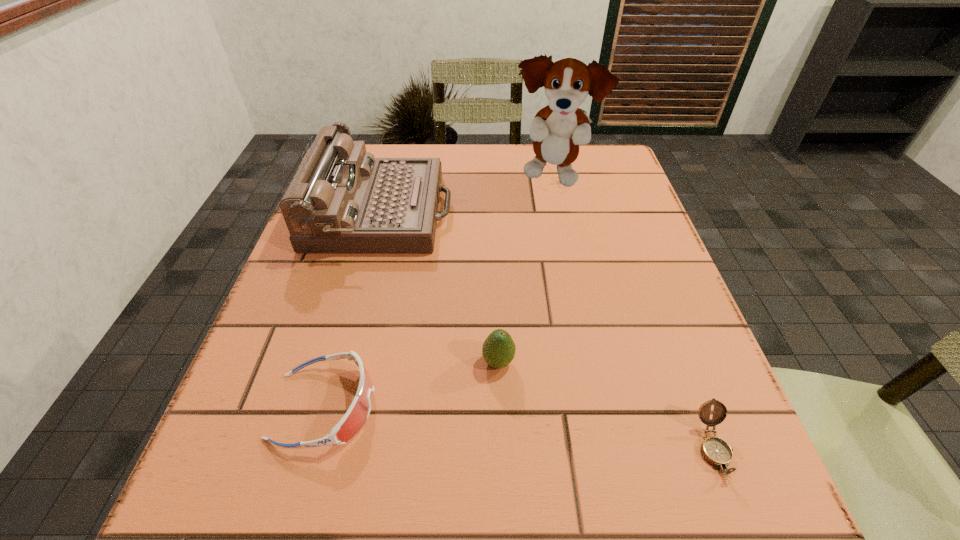
I want to click on vacant area that lies between the typewriter and the third shortest object, so click(x=440, y=287).

The image size is (960, 540). Find the location of `vacant space that is in between the rightmost object and the fourth tallest object`. vacant space that is in between the rightmost object and the fourth tallest object is located at coordinates (519, 427).

Identify the location of vacant area that lies between the goggles and the second object from right to left. The width and height of the screenshot is (960, 540). pyautogui.click(x=439, y=292).

The width and height of the screenshot is (960, 540). I want to click on vacant area between the fourth shortest object and the rightmost object, so click(x=547, y=330).

Where is `free space between the fourth shortest object and the rightmost object`? The height and width of the screenshot is (540, 960). free space between the fourth shortest object and the rightmost object is located at coordinates (547, 330).

Locate an element on the screen. This screenshot has height=540, width=960. free space between the goggles and the third object from right to left is located at coordinates (412, 384).

Find the location of a particular element. This screenshot has width=960, height=540. free spot between the fourth tallest object and the fourth object from left to right is located at coordinates (439, 292).

Choose which object is the third nearest neighbor to the compass. Please provide its 2D coordinates. Your answer should be formatted as a tuple, i.e. [(x, y)], where the tuple contains the x and y coordinates of a point satisfying the conditions above.

[(342, 200)]

Identify the location of object that is the second closest to the fourth object from left to right. Image resolution: width=960 pixels, height=540 pixels. (498, 350).

What are the coordinates of `vacant area in the image that satisfies the following two spatial constraints: 1. on the face of the puppy; 2. on the front-facing side of the second shortest object` in the screenshot? It's located at (601, 406).